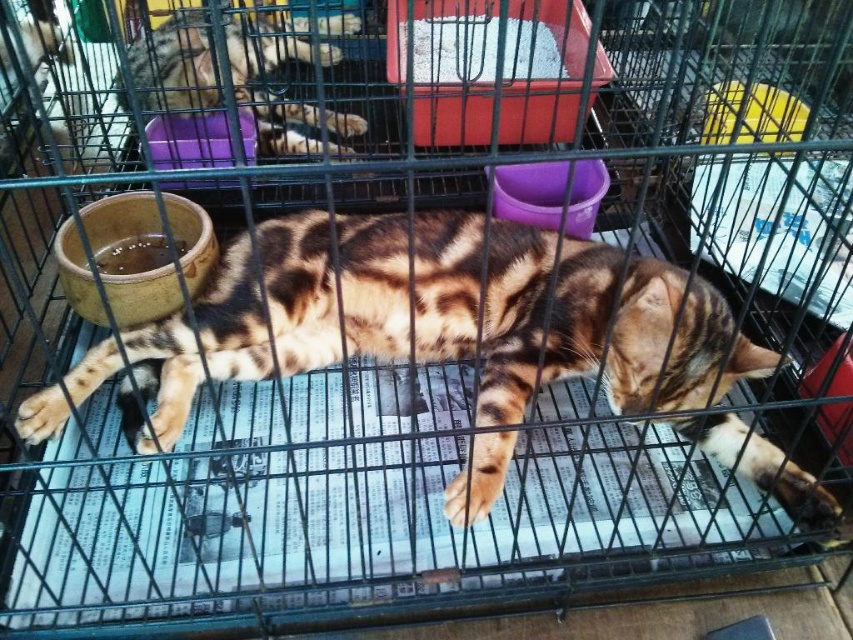
You are a veterinarian who needs to place a new food dish for the tabby fur cat at center. The dish you have is 10 inches in diameter. Where should you place the new dish so that it doesn

The new dish should be placed near the left side of the cage, where the existing beige ceramic food dish is located, as it is closer to the tabby fur cat at center compared to the purple plastic water bowl. This placement ensures the dish is within the cat

You are a veterinarian examining the cage setup for the tabby fur cat at center and the tabby fur cat at upper left. Based on their positions, which cat is closer to the purple plastic water bowl near the center?

The tabby fur cat at center is closer to the purple plastic water bowl near the center because it is in front of the tabby fur cat at upper left, meaning it is positioned closer to the center of the cage where the bowl is located.

Looking at the cage with the tabby fur cat at center and the tabby fur cat at upper left, which cat is positioned more to the right side of the cage?

The tabby fur cat at center is positioned more to the right side of the cage compared to the tabby fur cat at upper left.